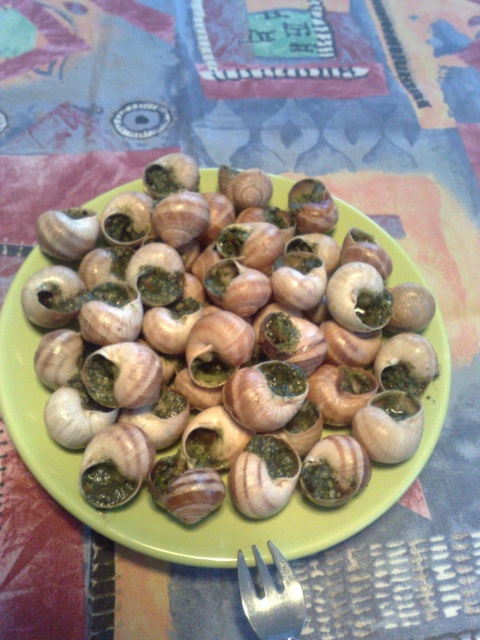
Question: Which object appears farthest from the camera in this image?

Choices:
 (A) silver metallic fork at bottom center
 (B) green matte snail at center

Answer: (B)

Question: Which point is closer to the camera?

Choices:
 (A) (106, 204)
 (B) (284, 593)

Answer: (B)

Question: Does green matte snail at center appear over silver metallic fork at bottom center?

Choices:
 (A) no
 (B) yes

Answer: (B)

Question: Which of the following is the farthest from the observer?

Choices:
 (A) (243, 582)
 (B) (171, 225)

Answer: (B)

Question: Can you confirm if green matte snail at center is positioned below silver metallic fork at bottom center?

Choices:
 (A) no
 (B) yes

Answer: (A)

Question: Can you confirm if green matte snail at center is thinner than silver metallic fork at bottom center?

Choices:
 (A) yes
 (B) no

Answer: (B)